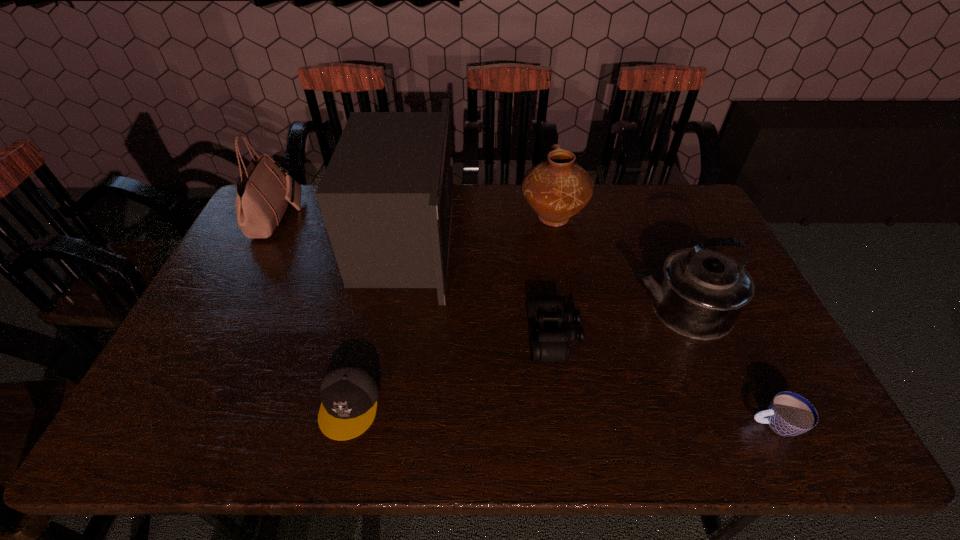
At what (x,y) coordinates should I click in order to perform the action: click on microwave oven. Please return your answer as a coordinate pair (x, y). This screenshot has height=540, width=960. Looking at the image, I should click on (386, 197).

You are a GUI agent. You are given a task and a screenshot of the screen. Output one action in this format:
    pyautogui.click(x=<x>, y=<y>)
    Task: Click on the leftmost object
    The image size is (960, 540).
    Given the screenshot: What is the action you would take?
    pyautogui.click(x=264, y=191)

Find the location of a particular element. Image resolution: width=960 pixels, height=540 pixels. kettle is located at coordinates (700, 293).

The image size is (960, 540). I want to click on pottery, so click(x=557, y=188).

What are the coordinates of `binoculars` in the screenshot? It's located at (551, 344).

At what (x,y) coordinates should I click in order to perform the action: click on cap. Please return your answer as a coordinate pair (x, y). Looking at the image, I should click on (349, 392).

Identify the location of cup. This screenshot has width=960, height=540. (789, 414).

Where is `free space located on the front-facing side of the microwave oven`? Image resolution: width=960 pixels, height=540 pixels. free space located on the front-facing side of the microwave oven is located at coordinates (550, 240).

Identify the location of vacant space located 0.210m on the side of the leftmost object with the attached pouch. The height and width of the screenshot is (540, 960). (358, 218).

The image size is (960, 540). What are the coordinates of `vacant area situated 0.140m with the spout at the front of the kettle` in the screenshot? It's located at (577, 308).